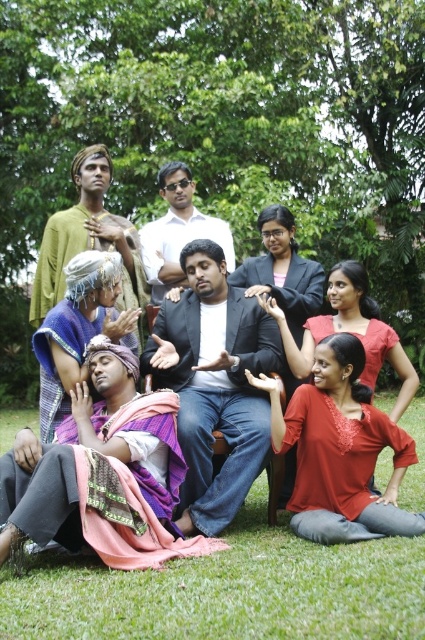
You are standing at the origin point of the image. Which object is located at the point with coordinates (x=214, y=385)?

The dark gray suit at center is located at point (x=214, y=385).

You are standing at the point marked as point (x=227, y=589). Looking towards the green grass at lower center, which direction would you face?

Since the green grass at lower center is located at point (x=227, y=589), you are already at that point. Therefore, you would face away from the green grass at lower center.

You are a photographer trying to capture a closeup of the dark gray suit at center and the matte red blouse at lower right. Which one would you need to zoom in more on to fill the frame?

The dark gray suit at center occupies less space than the matte red blouse at lower right, so you would need to zoom in more on the dark gray suit at center to fill the frame.